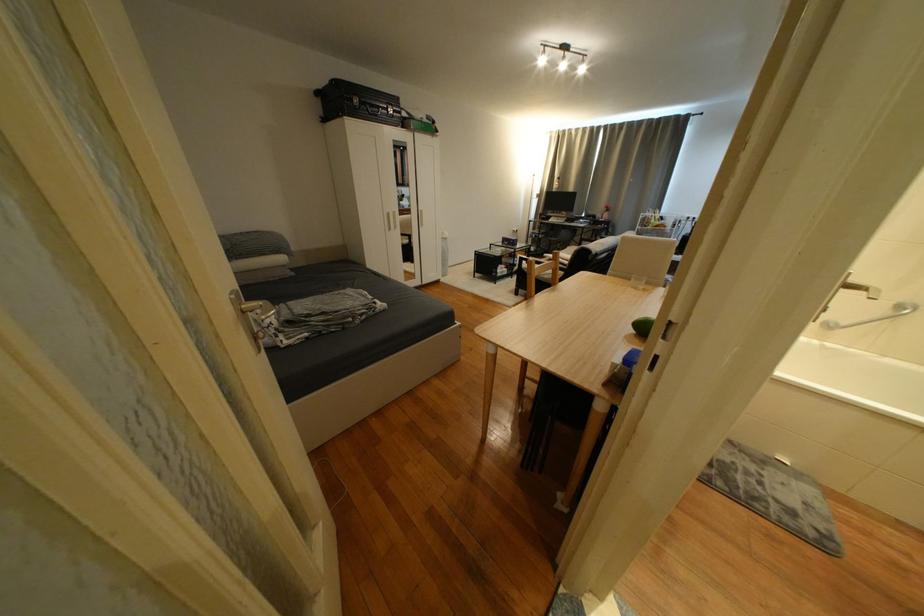
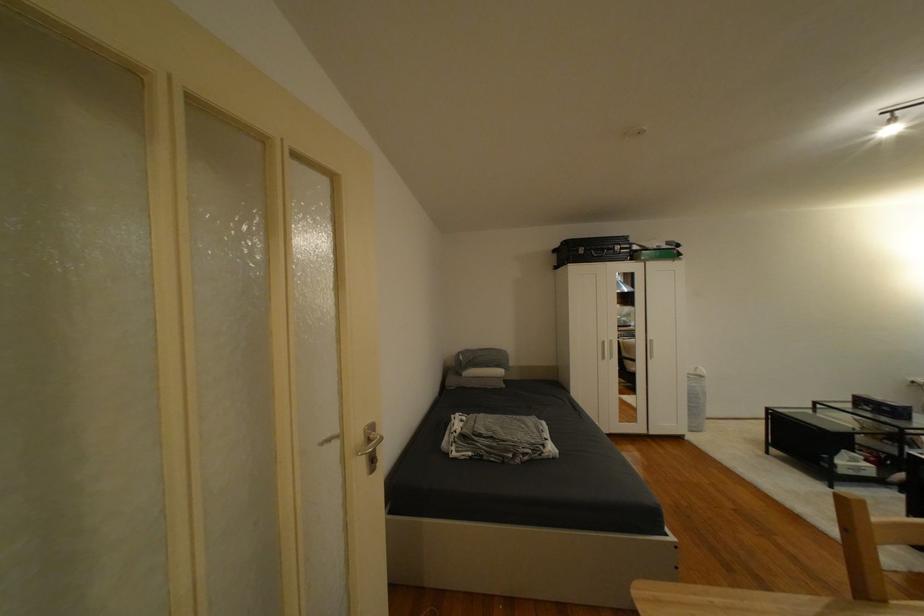
The point at [519,243] is marked in the first image. Where is the corresponding point in the second image?

(894, 410)